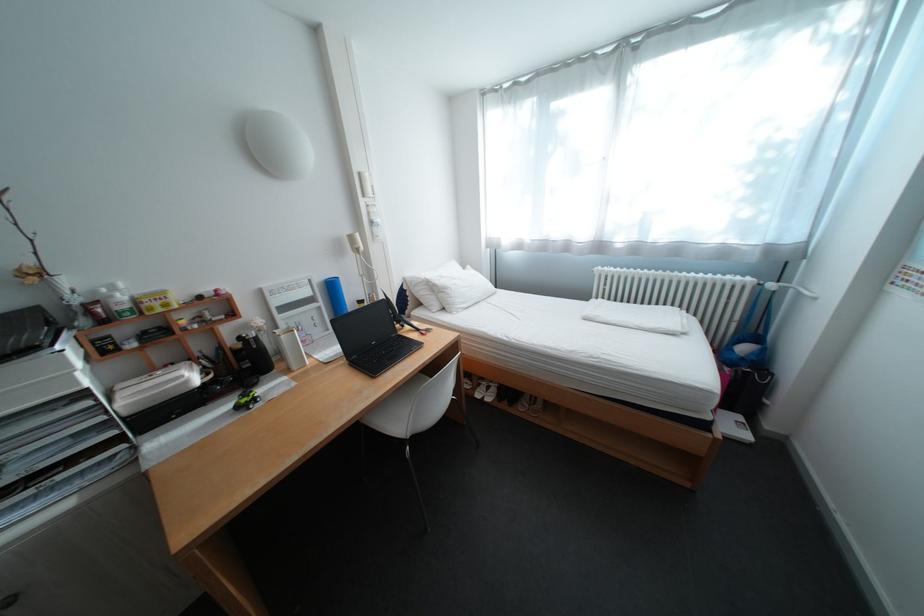
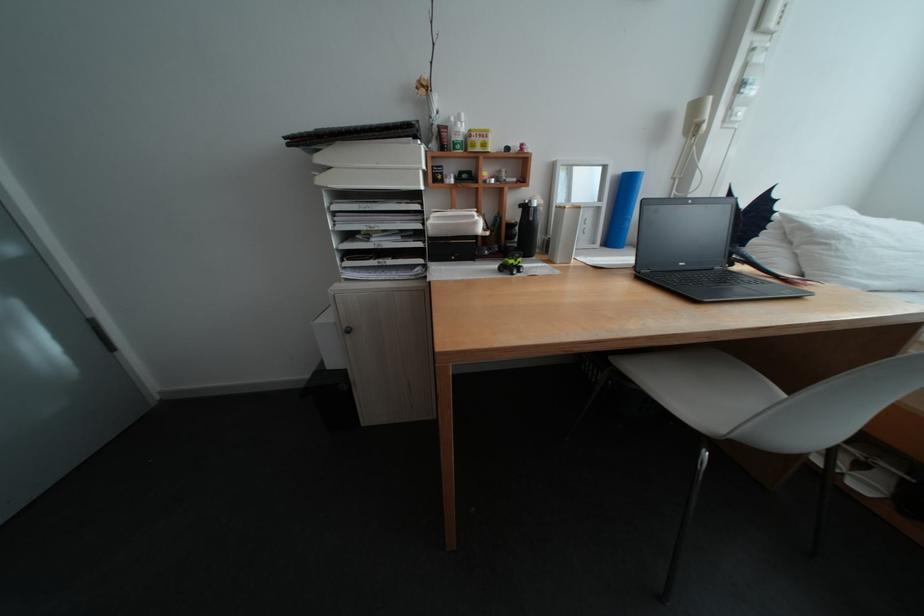
Question: The camera is either moving clockwise (left) or counter-clockwise (right) around the object. The first image is from the beginning of the video and the second image is from the end. Is the camera moving left or right when shooting the video?

Choices:
 (A) Left
 (B) Right

Answer: (B)